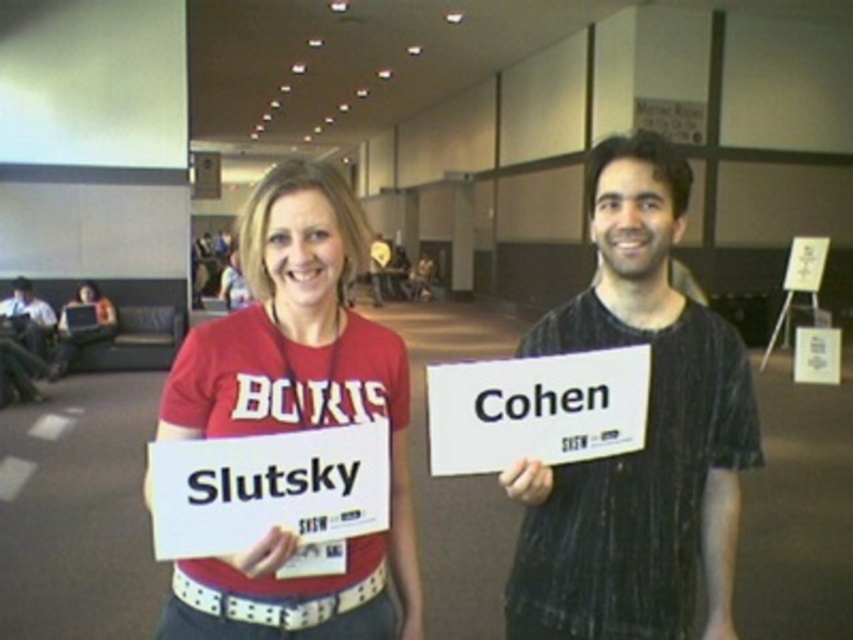
Question: From the image, what is the correct spatial relationship of black textured shirt at center in relation to matte red shirt at center?

Choices:
 (A) left
 (B) right

Answer: (B)

Question: Based on their relative distances, which object is farther from the matte red t-shirt at center?

Choices:
 (A) black textured shirt at center
 (B) matte red shirt at center

Answer: (B)

Question: Can you confirm if black textured shirt at center is bigger than matte red t-shirt at center?

Choices:
 (A) yes
 (B) no

Answer: (B)

Question: Which of these objects is positioned closest to the matte red shirt at center?

Choices:
 (A) black textured shirt at center
 (B) matte red t-shirt at center

Answer: (B)

Question: Is matte red t-shirt at center below matte red shirt at center?

Choices:
 (A) yes
 (B) no

Answer: (A)

Question: Which of these objects is positioned closest to the matte red shirt at center?

Choices:
 (A) black textured shirt at center
 (B) matte red t-shirt at center

Answer: (B)